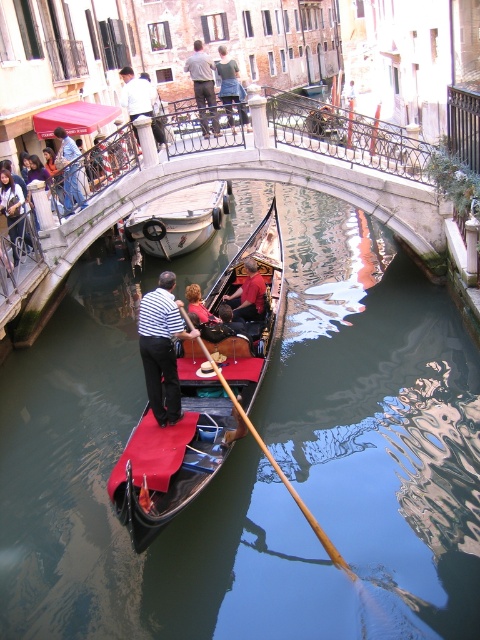
You are a tourist standing on the gondola and want to take a photo of both the striped fabric shirt at center and the white shirt at upper center in the same frame. Can you fit both in your camera viewfinder if your camera has a maximum viewing distance of 13 meters?

The striped fabric shirt at center and white shirt at upper center are 12.99 meters apart from each other. Since the maximum viewing distance of the camera is 13 meters, both shirts can be captured in the same frame.

You are a tourist standing on the bridge overlooking the canal. You see a silver metallic boat at center and a striped fabric shirt at center. Which object is closer to the left side of the bridge?

The silver metallic boat at center is closer to the left side of the bridge because it is positioned to the left of the striped fabric shirt at center.

You are a tourist in Venice and notice two men on the gondola. One is wearing a striped fabric shirt at center, and the other has a white shirt at upper center. From your perspective on the canal bank, which shirt is positioned to the right?

The striped fabric shirt at center is to the right of the white shirt at upper center, so the striped fabric shirt at center is positioned to the right.